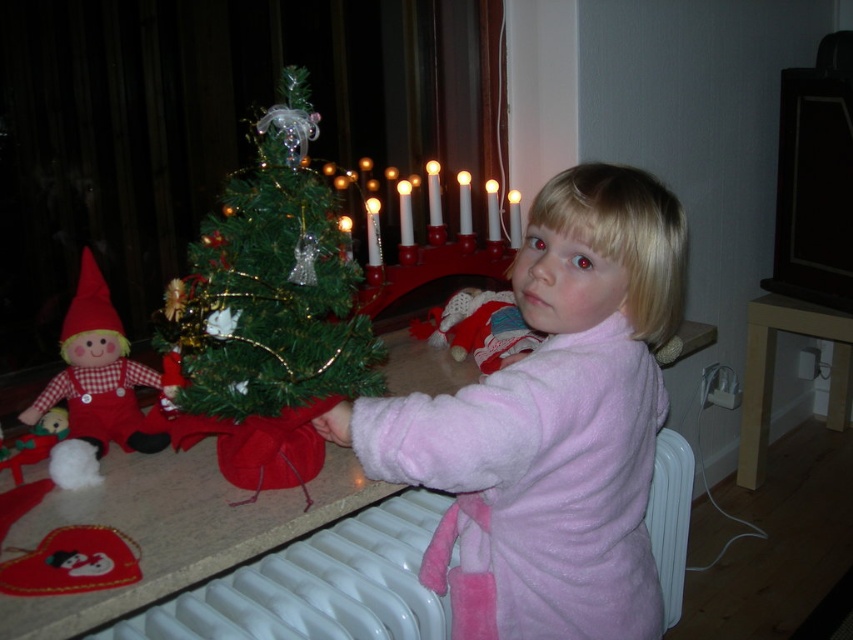
Which is above, pink fuzzy pajamas at center or green matte christmas tree at center?

Positioned higher is green matte christmas tree at center.

In the scene shown: Between pink fuzzy pajamas at center and green matte christmas tree at center, which one appears on the left side from the viewer's perspective?

From the viewer's perspective, green matte christmas tree at center appears more on the left side.

Describe the element at coordinates (550, 426) in the screenshot. I see `pink fuzzy pajamas at center` at that location.

Find the location of a particular element. pink fuzzy pajamas at center is located at coordinates (550, 426).

Who is shorter, pink fuzzy pajamas at center or velvet plush santa at center?

With less height is velvet plush santa at center.

Which is below, pink fuzzy pajamas at center or velvet plush santa at center?

pink fuzzy pajamas at center is lower down.

Where is `pink fuzzy pajamas at center`? This screenshot has width=853, height=640. pink fuzzy pajamas at center is located at coordinates (550, 426).

Image resolution: width=853 pixels, height=640 pixels. Find the location of `pink fuzzy pajamas at center`. pink fuzzy pajamas at center is located at coordinates (550, 426).

Where is `pink fuzzy pajamas at center`? This screenshot has width=853, height=640. pink fuzzy pajamas at center is located at coordinates (550, 426).